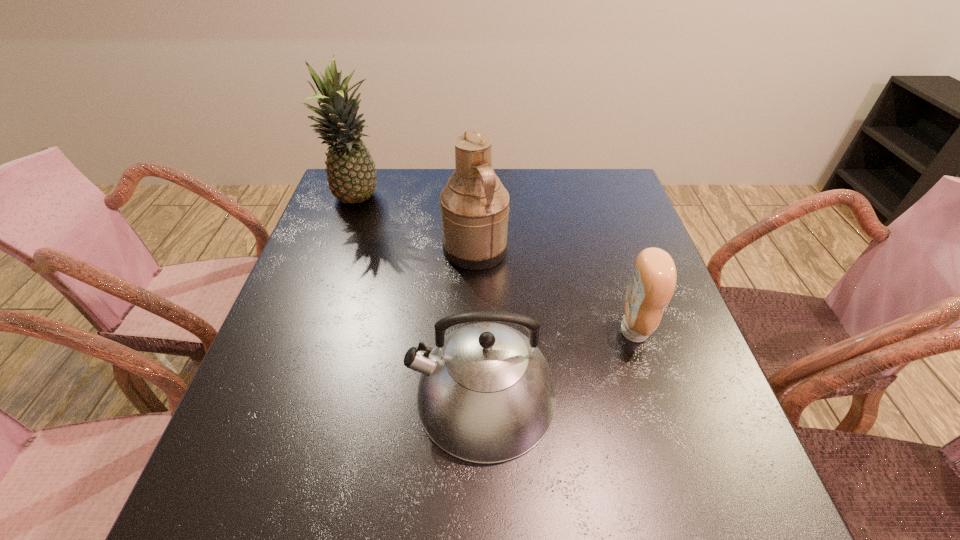
Identify which object is the nearest to the condiment. Please provide its 2D coordinates. Your answer should be formatted as a tuple, i.e. [(x, y)], where the tuple contains the x and y coordinates of a point satisfying the conditions above.

[(486, 394)]

Identify which object is the nearest to the second farthest object. Please provide its 2D coordinates. Your answer should be formatted as a tuple, i.e. [(x, y)], where the tuple contains the x and y coordinates of a point satisfying the conditions above.

[(351, 174)]